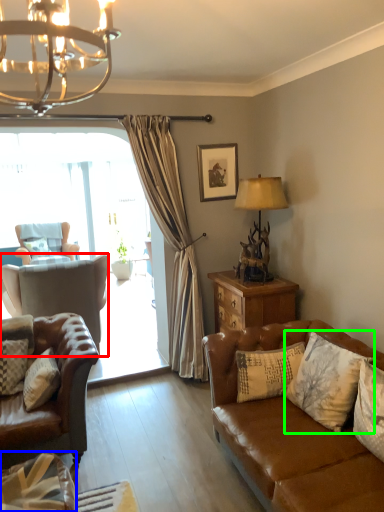
Question: Estimate the real-world distances between objects in this image. Which object is farther from chair (highlighted by a red box), pillow (highlighted by a blue box) or pillow (highlighted by a green box)?

Choices:
 (A) pillow
 (B) pillow

Answer: (B)